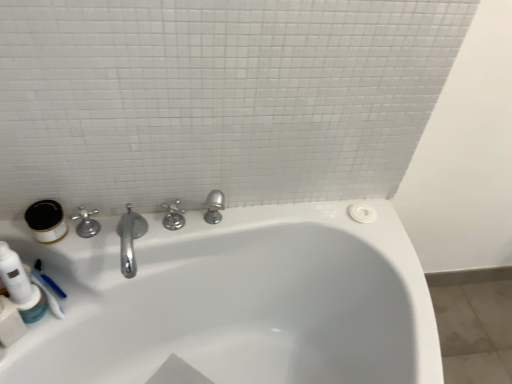
What are the coordinates of `vacant region to the right of polished chrome faucet at center, which is counted as the 2th tap, starting from the left` in the screenshot? It's located at (221, 221).